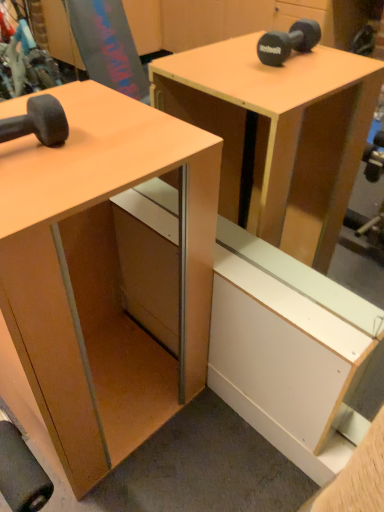
The image size is (384, 512). In order to click on free location to the right of matte black dumbbell at left in this screenshot , I will do `click(92, 153)`.